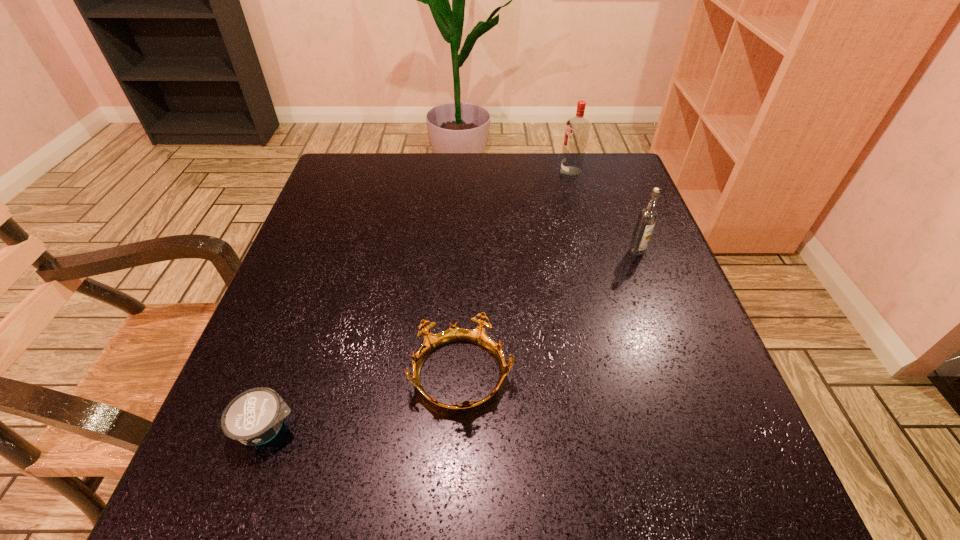
Identify the location of vacant space located 0.140m on the front label of the left vodka. [508, 172].

What are the coordinates of `vacant space located 0.310m on the label of the right vodka` in the screenshot? It's located at (686, 384).

Locate an element on the screen. The height and width of the screenshot is (540, 960). free region located on the back of the crown is located at coordinates (468, 205).

This screenshot has height=540, width=960. Find the location of `vacant area situated on the front of the yogurt`. vacant area situated on the front of the yogurt is located at coordinates (239, 507).

The width and height of the screenshot is (960, 540). I want to click on object that is positioned at the far edge, so click(x=577, y=130).

Find the location of `object that is at the left edge`. object that is at the left edge is located at coordinates (254, 417).

Locate an element on the screen. object present at the far right corner is located at coordinates (577, 130).

This screenshot has height=540, width=960. What are the coordinates of `free spot at the far edge of the desktop` in the screenshot? It's located at (398, 184).

Image resolution: width=960 pixels, height=540 pixels. Identify the location of free space at the near edge. (410, 517).

Where is `free space at the left edge`? The height and width of the screenshot is (540, 960). free space at the left edge is located at coordinates pyautogui.click(x=335, y=213).